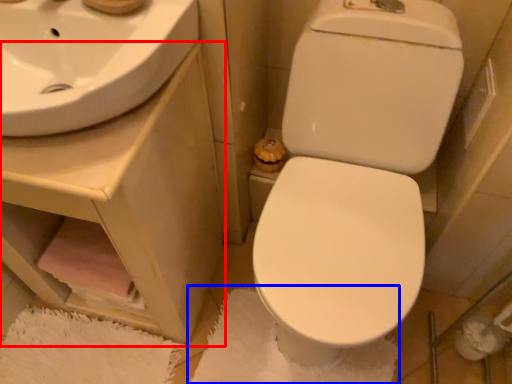
Question: Which object appears farthest to the camera in this image, counter top (highlighted by a red box) or bath mat (highlighted by a blue box)?

Choices:
 (A) counter top
 (B) bath mat

Answer: (B)